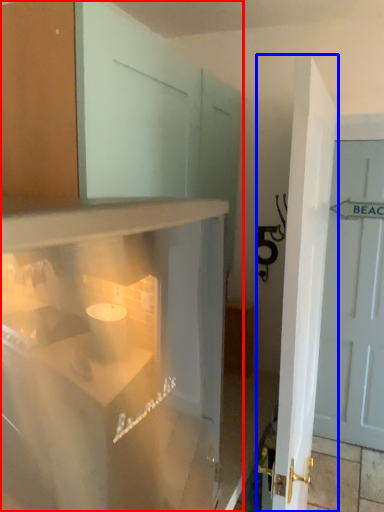
Question: Which of the following is the farthest to the observer, cabinetry (highlighted by a red box) or door (highlighted by a blue box)?

Choices:
 (A) cabinetry
 (B) door

Answer: (B)